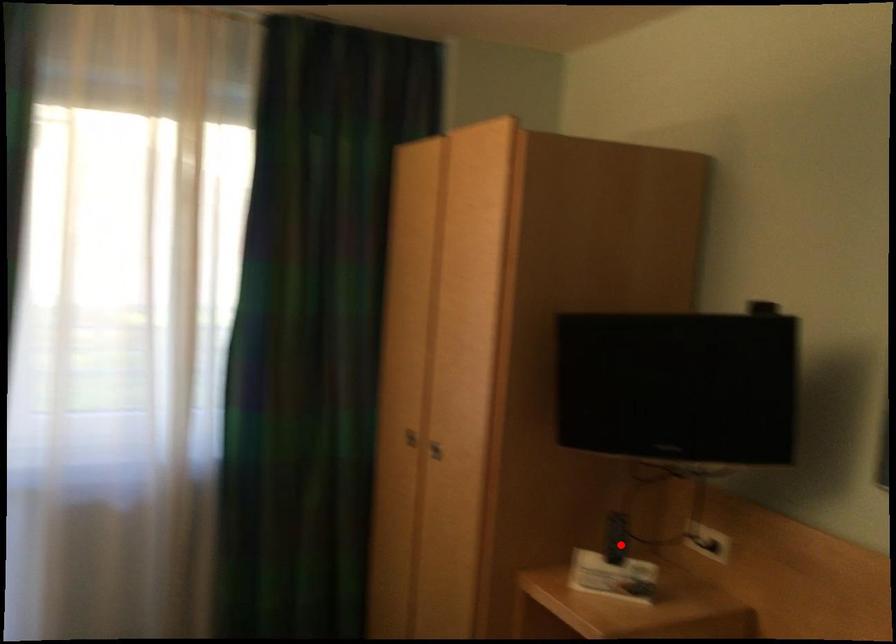
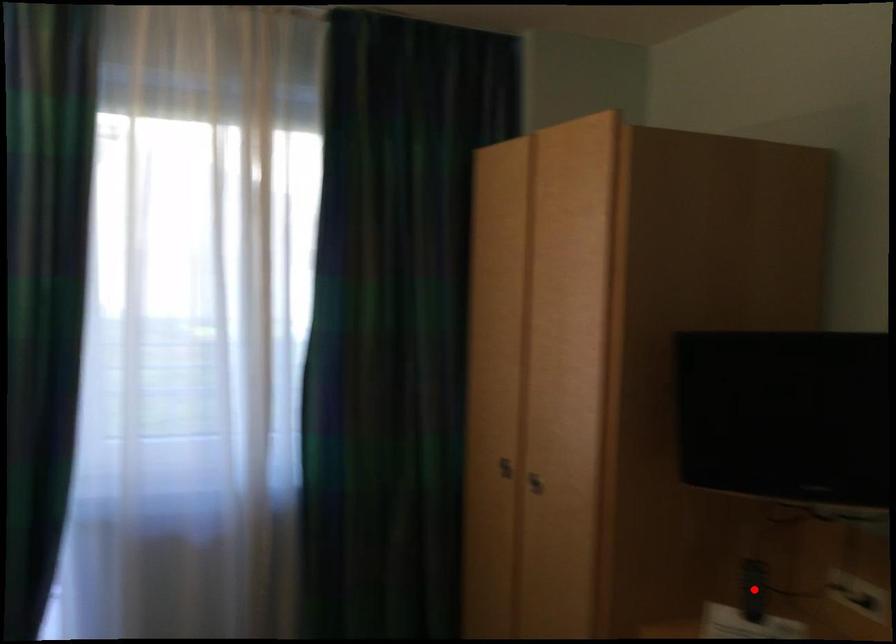
I am providing you with two images of the same scene from different viewpoints. A red point is marked on the first image and another point is marked on the second image. Does the point marked in image1 correspond to the same location as the one in image2?

Yes